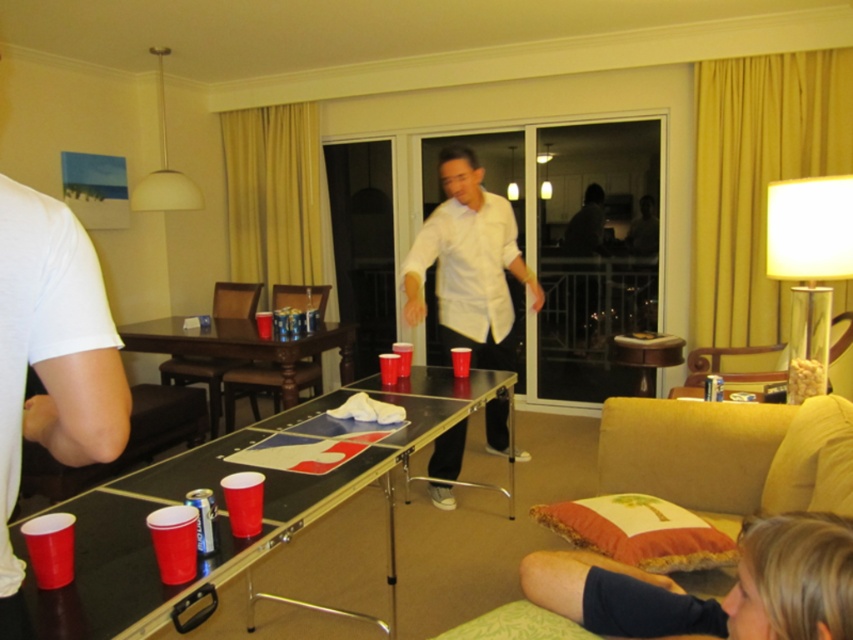
Question: Which point appears farthest from the camera in this image?

Choices:
 (A) (270, 355)
 (B) (297, 406)

Answer: (A)

Question: Which is farther from the blonde hair at lower right?

Choices:
 (A) white matte t-shirt at left
 (B) white matte shirt at center
 (C) wooden table at center

Answer: (C)

Question: Which object is farther from the camera taking this photo?

Choices:
 (A) white matte shirt at center
 (B) white matte t-shirt at left
 (C) wooden table at center

Answer: (C)

Question: Does shiny black table at center appear on the right side of blonde hair at lower right?

Choices:
 (A) no
 (B) yes

Answer: (A)

Question: Observing the image, what is the correct spatial positioning of blonde hair at lower right in reference to wooden table at center?

Choices:
 (A) below
 (B) above

Answer: (A)

Question: Is shiny black table at center to the right of white matte t-shirt at left from the viewer's perspective?

Choices:
 (A) no
 (B) yes

Answer: (B)